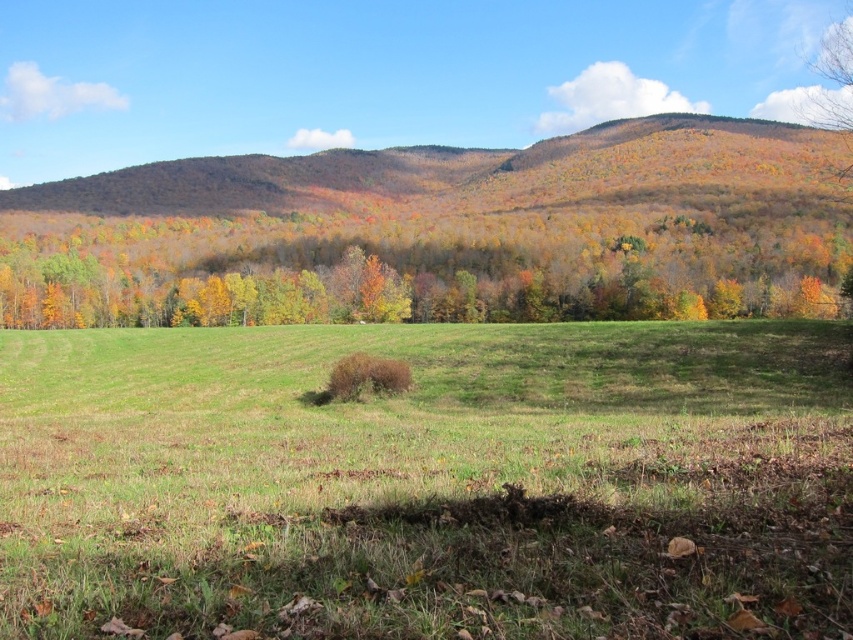
You are standing at point A located at coordinates point A at (740,280) and want to walk to point B located at coordinates point B at 0.561, 0.132. The path between them is straight. If your walking speed is 3 feet per second, how many seconds will it take you to reach point B from point A?

The distance between point A at (740,280) and point B at 0.561, 0.132 is 551.23 feet. At a speed of 3 feet per second, it would take approximately 551.23 divided by 3 equals approximately 183.74 seconds to reach point B.

You are standing in the middle of the field and want to reach the multicolored foliage at center. Which direction should you move in to get there?

The multicolored foliage at center is located at point coordinates (x=407, y=273), so you should move towards the center of the image to reach it.

You are an artist planning to paint the scene. You want to ensure the multicolored foliage at center and the smooth bark tree at upper right are proportionally accurate. Which object should be drawn taller in your painting?

The smooth bark tree at upper right should be drawn taller because the multicolored foliage at center is shorter than it.